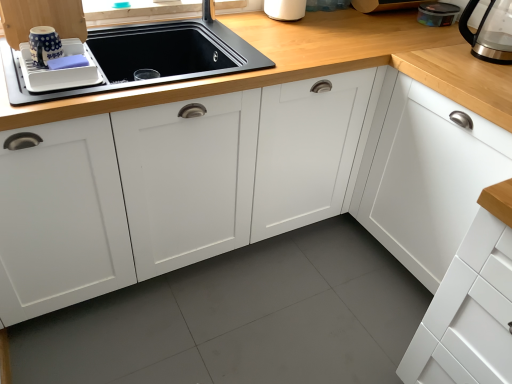
At what (x,y) coordinates should I click in order to perform the action: click on vacant area that is in front of blue dotted cup at upper left, the second appliance in the left-to-right sequence. Please return your answer as a coordinate pair (x, y). The image size is (512, 384). Looking at the image, I should click on (36, 87).